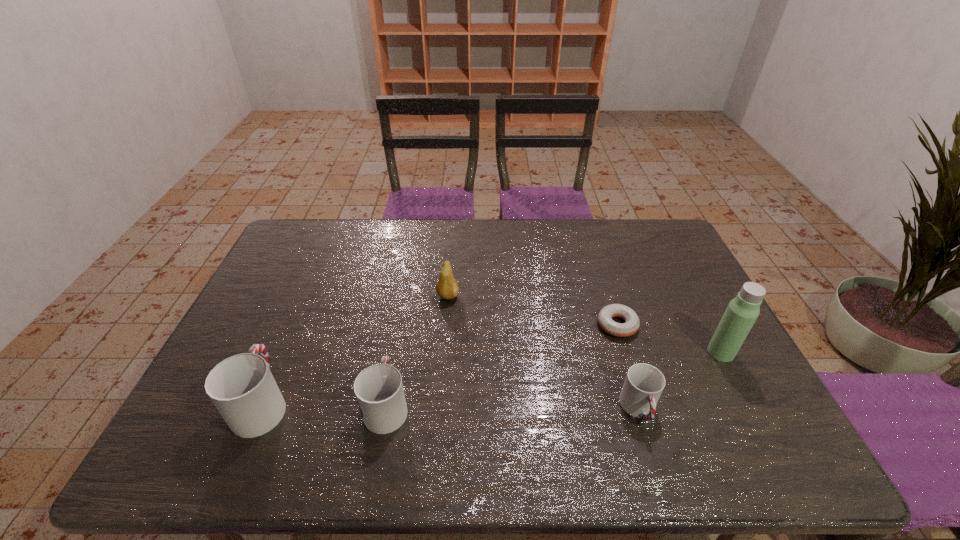
If equal spacing is desired by inserting an extra cup among them, please point out a free spot for this new cup. Please provide its 2D coordinates. Your answer should be formatted as a tuple, i.e. [(x, y)], where the tuple contains the x and y coordinates of a point satisfying the conditions above.

[(513, 407)]